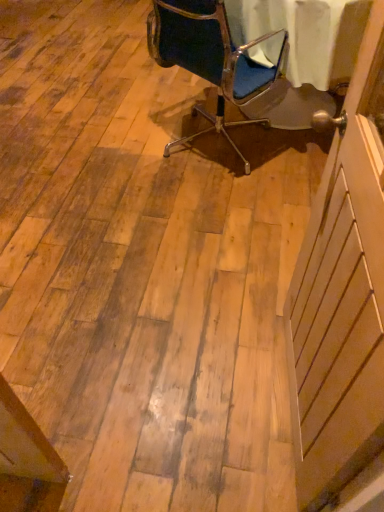
Where is `vacant space in front of blue fabric chair at upper center`? vacant space in front of blue fabric chair at upper center is located at coordinates (208, 216).